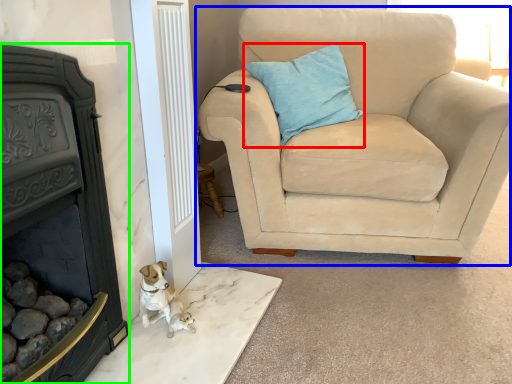
Question: Which is nearer to the pillow (highlighted by a red box)? chair (highlighted by a blue box) or fireplace (highlighted by a green box).

Choices:
 (A) chair
 (B) fireplace

Answer: (A)